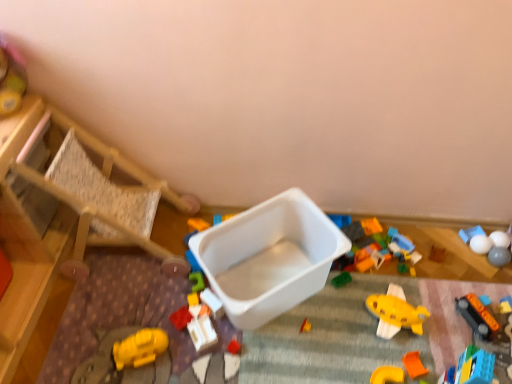
You are a GUI agent. You are given a task and a screenshot of the screen. Output one action in this format:
    pyautogui.click(x=<x>, y=<y>)
    Task: Click on the vacant area that is in front of white plastic container at center, which is counted as the 12th toy, starting from the right
    The height and width of the screenshot is (384, 512).
    Given the screenshot: What is the action you would take?
    pyautogui.click(x=202, y=366)